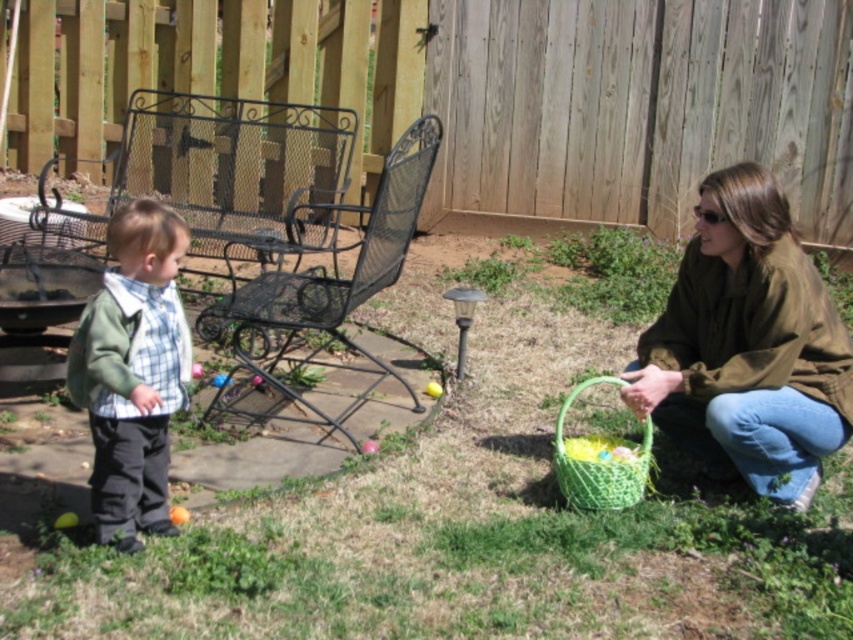
You are standing in the backyard scene. There is a point at coordinates (x=747, y=346). What object is located at this point?

The point at coordinates (x=747, y=346) corresponds to the matte brown jacket at lower right.

You are a photographer trying to capture a candid shot of the two people in the scene. You want to ensure that both the matte brown jacket at lower right and the green cotton shirt at left are visible in the frame. Based on their positions, which person is closer to the camera?

The matte brown jacket at lower right is closer to the camera because the green cotton shirt at left is positioned behind it.

You are a photographer trying to capture a candid shot of the matte brown jacket at lower right and the green cotton shirt at left. Since you want to ensure both are visible in the frame, can you determine which one is higher in the image?

The matte brown jacket at lower right is above the green cotton shirt at left, so it is higher in the image.